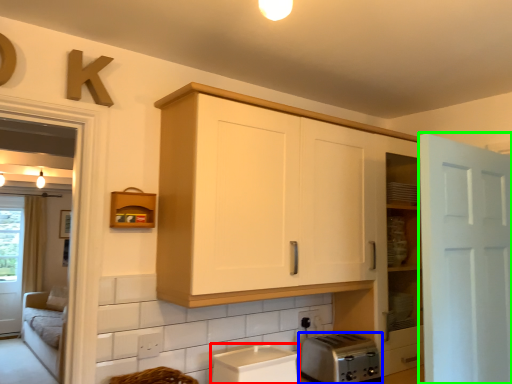
Question: Estimate the real-world distances between objects in this image. Which object is closer to appliance (highlighted by a red box), toaster (highlighted by a blue box) or door (highlighted by a green box)?

Choices:
 (A) toaster
 (B) door

Answer: (A)